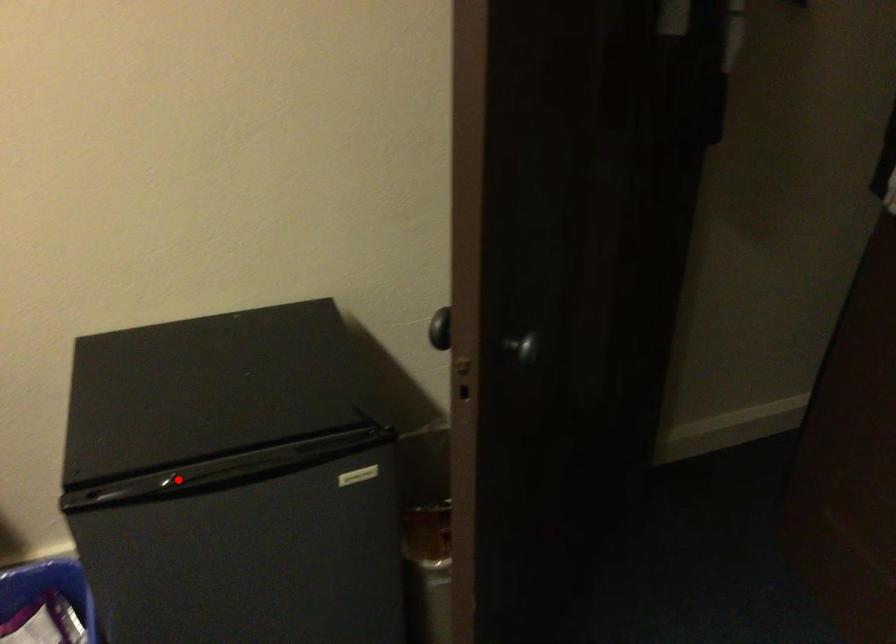
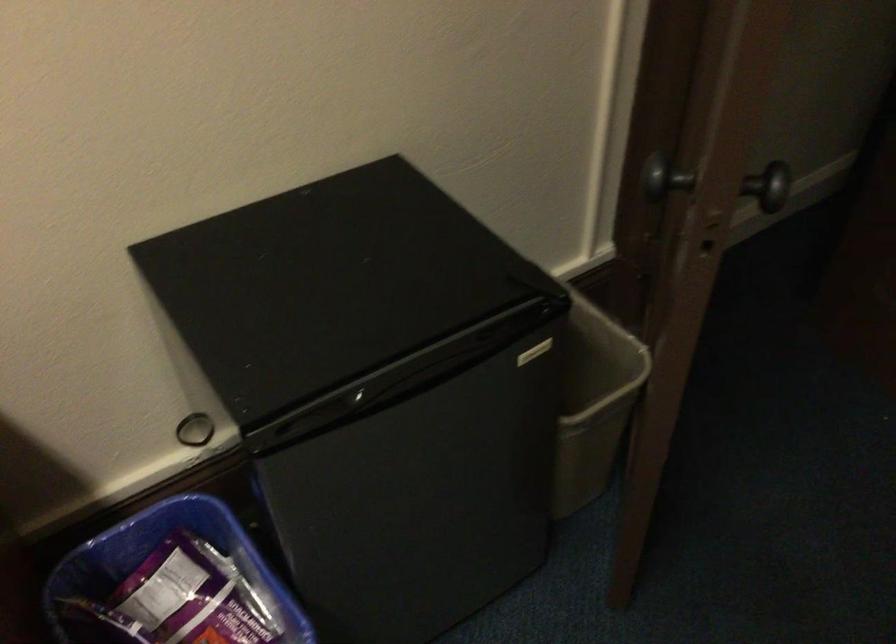
The point at the highlighted location is marked in the first image. Where is the corresponding point in the second image?

(365, 399)